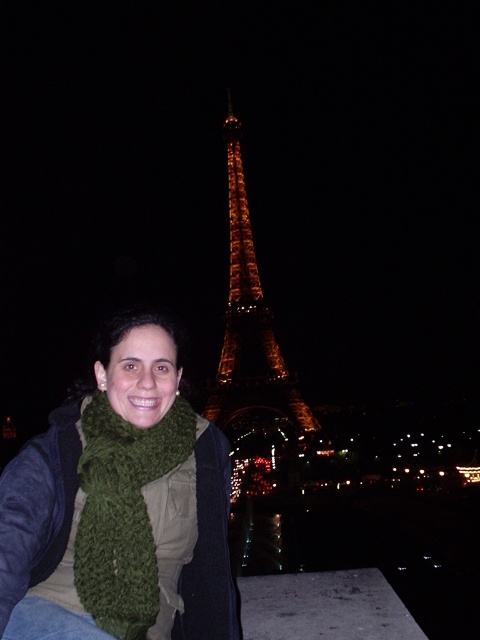
Question: Among these objects, which one is farthest from the camera?

Choices:
 (A) illuminated glass eiffel tower at center
 (B) green knitted scarf at lower left
 (C) green knitted scarf at center

Answer: (B)

Question: Which point is closer to the camera?

Choices:
 (A) (68, 605)
 (B) (264, 305)
 (C) (137, 596)

Answer: (A)

Question: Can you confirm if green knitted scarf at lower left is wider than illuminated glass eiffel tower at center?

Choices:
 (A) no
 (B) yes

Answer: (B)

Question: Can you confirm if green knitted scarf at center is positioned below green knitted scarf at lower left?

Choices:
 (A) no
 (B) yes

Answer: (A)

Question: Which point is farther to the camera?

Choices:
 (A) green knitted scarf at lower left
 (B) green knitted scarf at center
 (C) illuminated glass eiffel tower at center

Answer: (A)

Question: Is the position of green knitted scarf at center more distant than that of green knitted scarf at lower left?

Choices:
 (A) yes
 (B) no

Answer: (B)